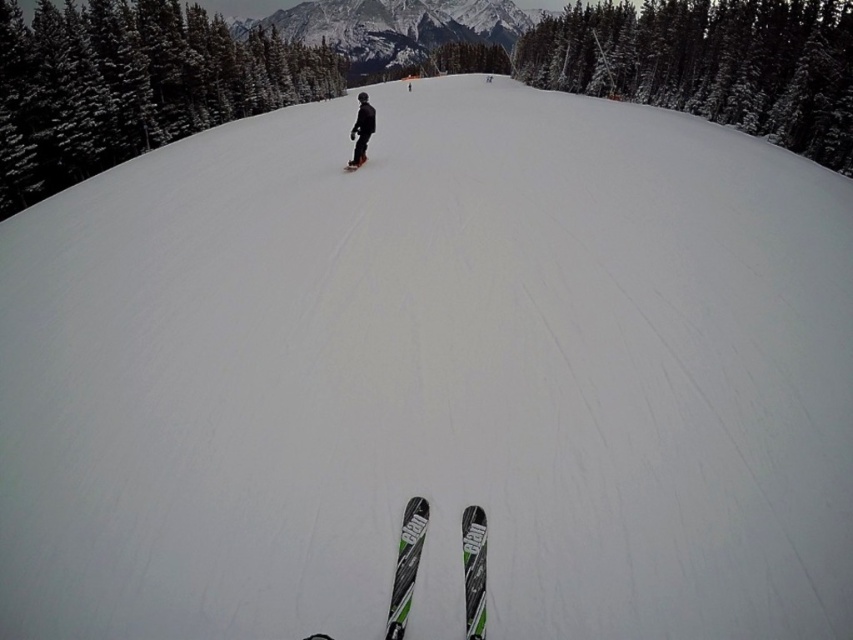
Question: Does green matte skis at center have a larger size compared to black matte snowboarder at center?

Choices:
 (A) no
 (B) yes

Answer: (A)

Question: Considering the real-world distances, which object is farthest from the green matte skis at center?

Choices:
 (A) snowy evergreen tree at upper right
 (B) snowy granite mountain at upper center
 (C) black matte snowboarder at center

Answer: (B)

Question: Can you confirm if green textured snowboard at upper center is wider than snowy evergreen tree at upper right?

Choices:
 (A) no
 (B) yes

Answer: (B)

Question: Estimate the real-world distances between objects in this image. Which object is farther from the green matte skis at center?

Choices:
 (A) black matte snowboard at center
 (B) snowy granite mountain at upper center
 (C) snowy evergreen tree at upper right

Answer: (B)

Question: Which object is farther from the camera taking this photo?

Choices:
 (A) black matte snowboard at center
 (B) green matte skis at center
 (C) snowy granite mountain at upper center
 (D) green textured snowboard at upper center

Answer: (C)

Question: Is snowy evergreen tree at upper right to the left of snowy granite mountain at upper center from the viewer's perspective?

Choices:
 (A) no
 (B) yes

Answer: (A)